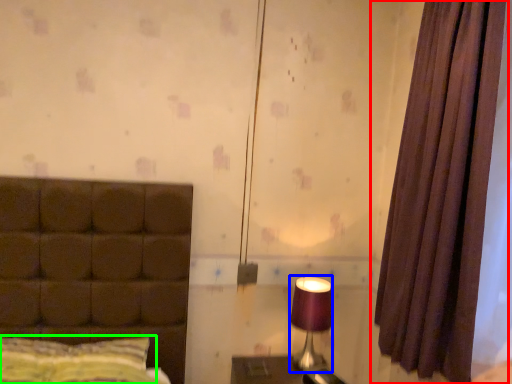
Question: Estimate the real-world distances between objects in this image. Which object is farther from curtain (highlighted by a red box), table lamp (highlighted by a blue box) or pillow (highlighted by a green box)?

Choices:
 (A) table lamp
 (B) pillow

Answer: (B)